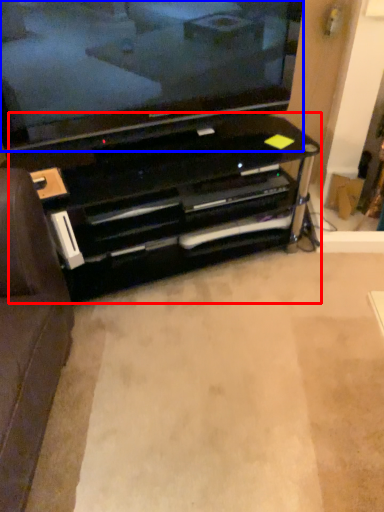
Question: Which object appears farthest to the camera in this image, entertainment center (highlighted by a red box) or television (highlighted by a blue box)?

Choices:
 (A) entertainment center
 (B) television

Answer: (A)